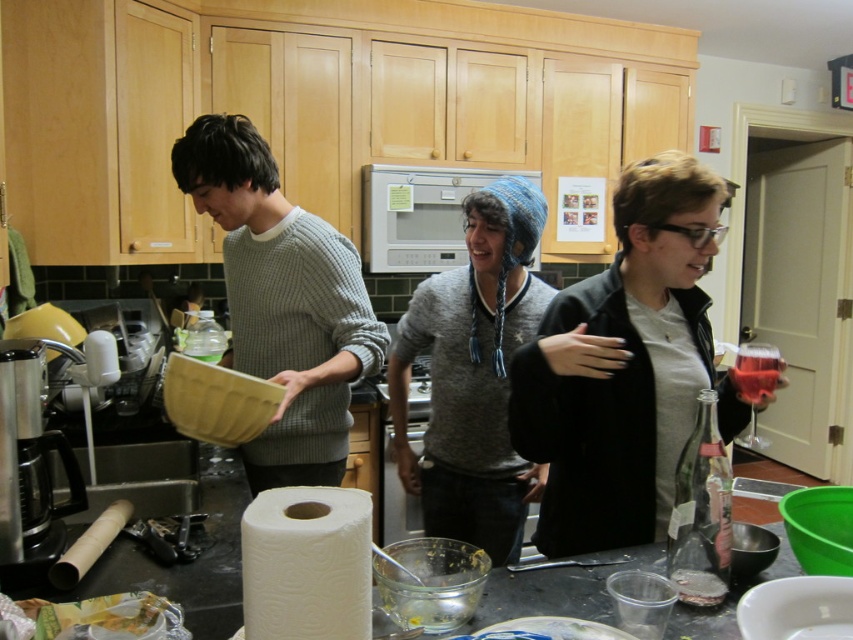
Question: Which of the following is the closest to the observer?

Choices:
 (A) matte black jacket at center
 (B) gray knitted sweater at center
 (C) white paper towel at center
 (D) white paper towel at lower left

Answer: (C)

Question: Is gray knitted sweater at center wider than metallic silver blender at left?

Choices:
 (A) yes
 (B) no

Answer: (A)

Question: Which of the following is the closest to the observer?

Choices:
 (A) (300, 412)
 (B) (97, 552)
 (C) (779, 356)
 (D) (711, 540)

Answer: (D)

Question: Is gray knitted sweater at center above matte gray sweater at center?

Choices:
 (A) yes
 (B) no

Answer: (A)

Question: Which is nearer to the white matte microwave at center?

Choices:
 (A) translucent glass wine at right
 (B) white paper towel at lower left
 (C) white paper towel at center
 (D) matte gray sweater at center

Answer: (D)

Question: Is gray knitted sweater at center positioned behind white matte microwave at center?

Choices:
 (A) no
 (B) yes

Answer: (A)